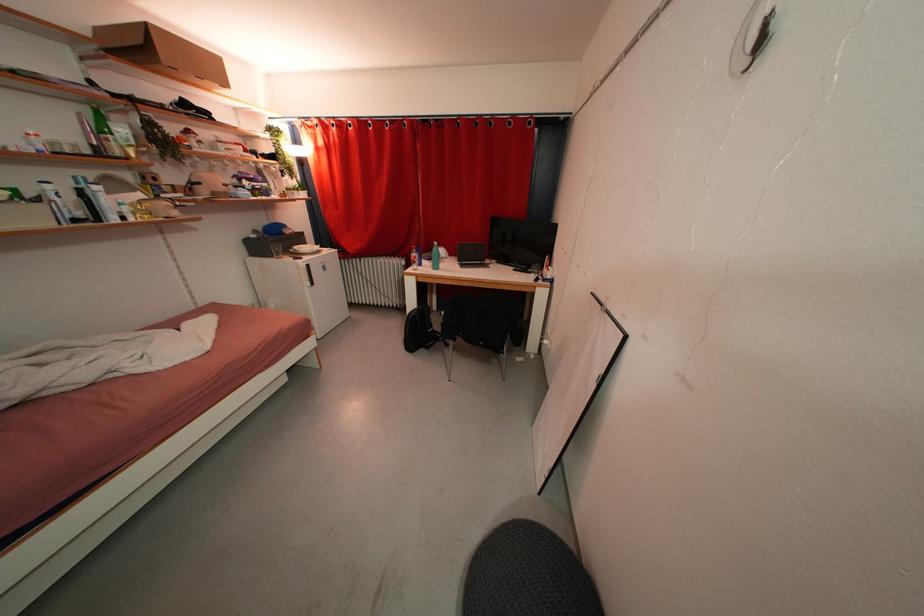
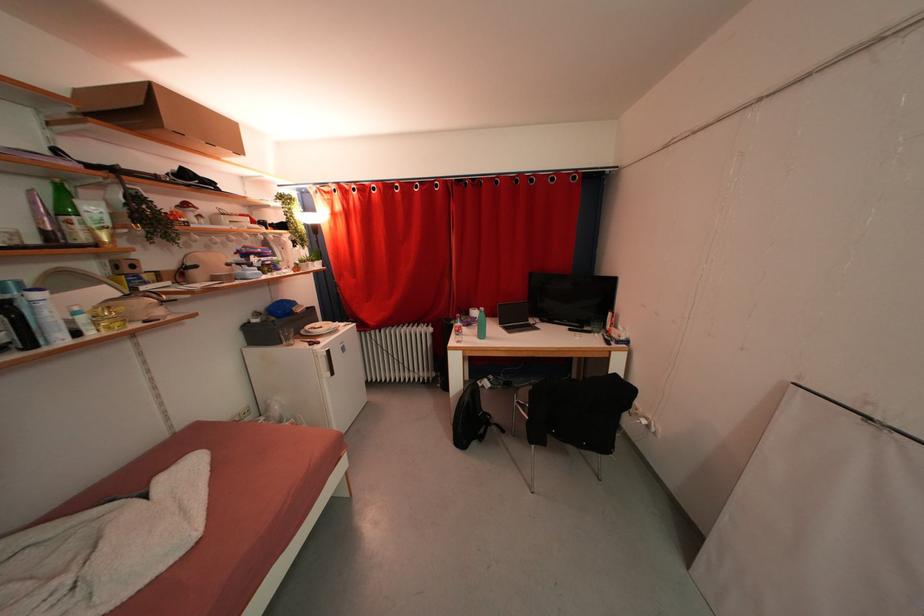
The point at (409, 265) is marked in the first image. Where is the corresponding point in the second image?

(436, 333)